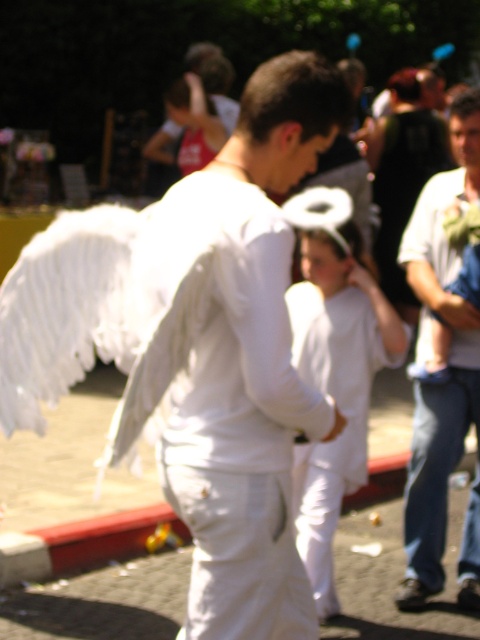
You are a photographer at the event and want to capture a photo where both the white cotton shirt at center and the black fabric hair at upper center are clearly visible. Based on their positions, which object should you focus on first to ensure both are in focus?

The white cotton shirt at center is positioned under the black fabric hair at upper center. To ensure both are in focus, you should focus on the black fabric hair at upper center first since it is closer to the camera, and the white cotton shirt at center will naturally fall into focus as it is behind it.

You are a photographer trying to capture the perfect shot of the white cotton shirt at center and the black fabric hair at upper center. Which object should you zoom in on to ensure it takes up more space in your photo?

The black fabric hair at upper center should be zoomed in on because its width is greater than the white cotton shirt at center, allowing it to occupy more space in the photo.